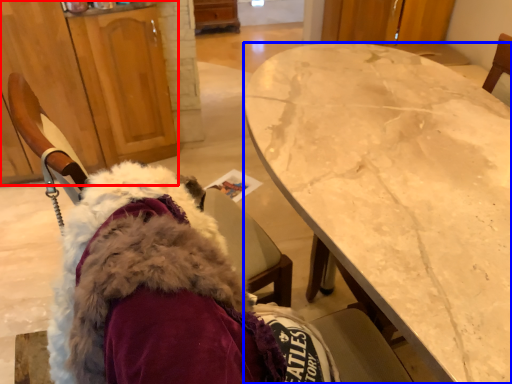
Question: Which object appears closest to the camera in this image, cabinetry (highlighted by a red box) or desk (highlighted by a blue box)?

Choices:
 (A) cabinetry
 (B) desk

Answer: (B)